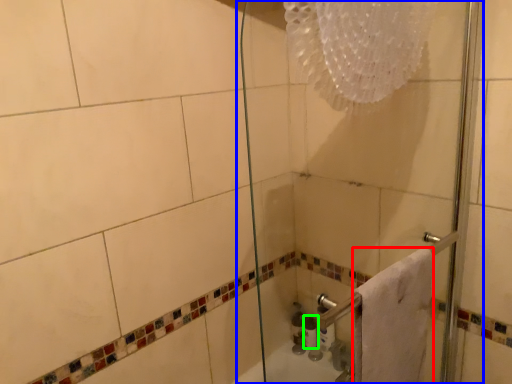
Question: Considering the real-world distances, which object is farthest from towel (highlighted by a red box)? shower door (highlighted by a blue box) or toiletry (highlighted by a green box)?

Choices:
 (A) shower door
 (B) toiletry

Answer: (B)